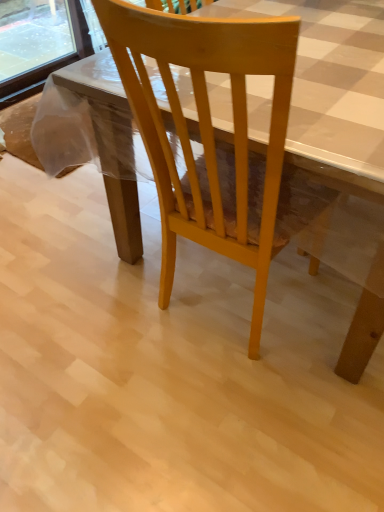
Question: Should I look upward or downward to see light wood chair at center?

Choices:
 (A) up
 (B) down

Answer: (A)